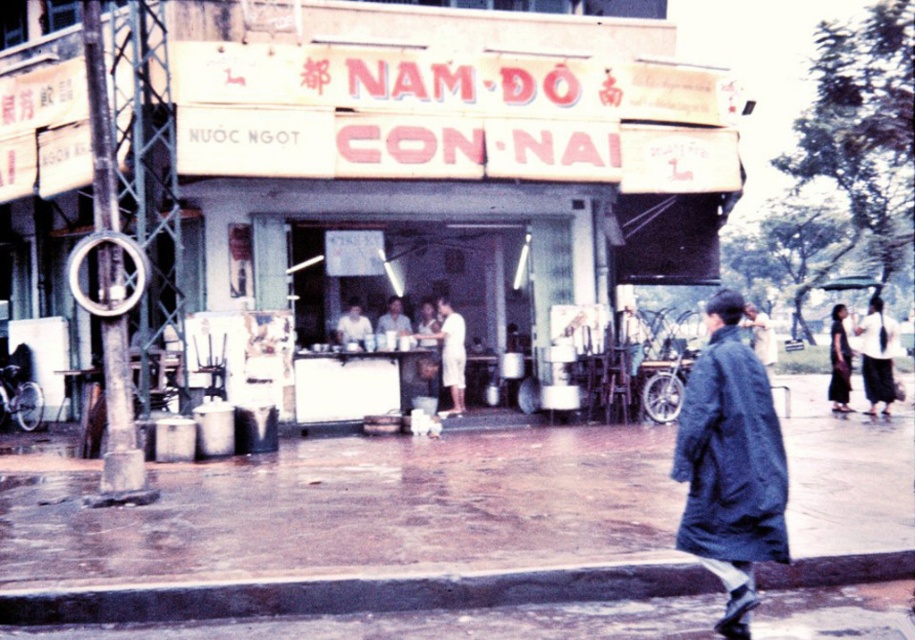
You are a customer at the NAM DO stall and want to order a drink. The menu items are listed on the yellowish faded signboard at center. However, you notice a dark blue fabric dress at right hanging nearby. Which object is closer to the counter where you are standing?

The yellowish faded signboard at center is closer to the counter where you are standing because it is below the dark blue fabric dress at right, meaning it is positioned lower and nearer to the counter area.

You are a customer at the NAM DO food stall and want to order a drink. You notice two dark blue fabric items hanging on the stall. Which dark blue fabric item is closer to you, the dark blue fabric coat at lower right or the dark blue fabric dress at right?

The dark blue fabric coat at lower right is closer to the viewer than the dark blue fabric dress at right.

You are a customer standing at the entrance of the market stall named NAM DO. You see the yellowish faded signboard at center and the dark blue fabric dress at right. If you want to order a drink from the counter, which object should you approach first?

You should approach the yellowish faded signboard at center first because it is closer to you than the dark blue fabric dress at right, as the distance between them is 35.89 feet.